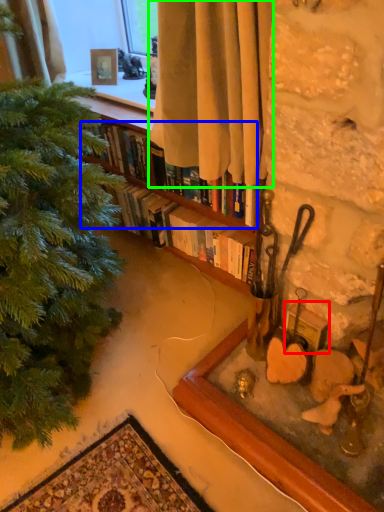
Question: Which object is positioned closest to picture frame (highlighted by a red box)? Select from book (highlighted by a blue box) and curtain (highlighted by a green box).

Choices:
 (A) book
 (B) curtain

Answer: (A)